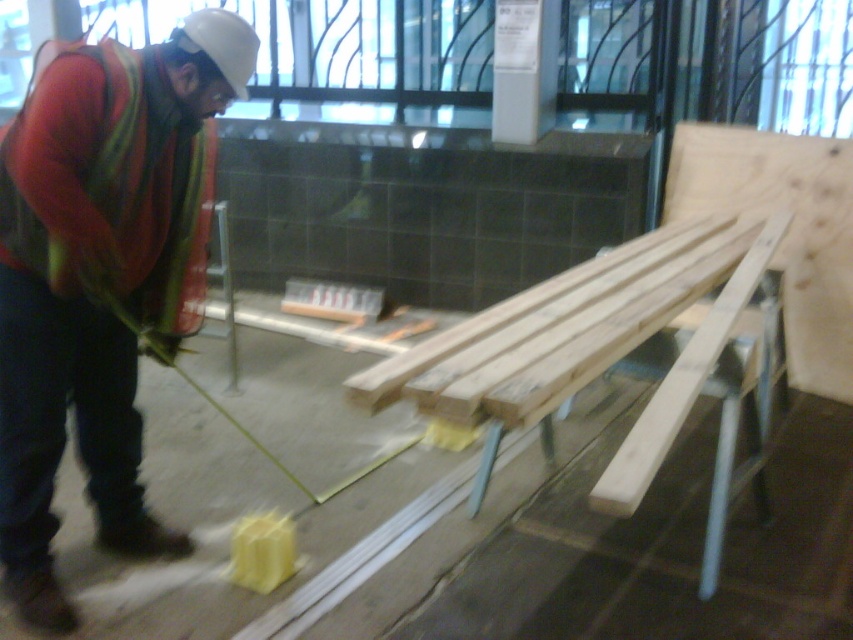
You are a safety inspector checking the workspace. You notice the orange safety vest at left and the natural wood at center. Which object is closer to you as you inspect the scene?

The orange safety vest at left is closer to you because it is further to the viewer than the natural wood at center, meaning it appears nearer in the scene.

You are an inspector checking safety equipment. You notice the orange safety vest at left and the light brown wood at upper right. Which object is wider according to the provided description?

The orange safety vest at left might be wider than light brown wood at upper right according to the description.